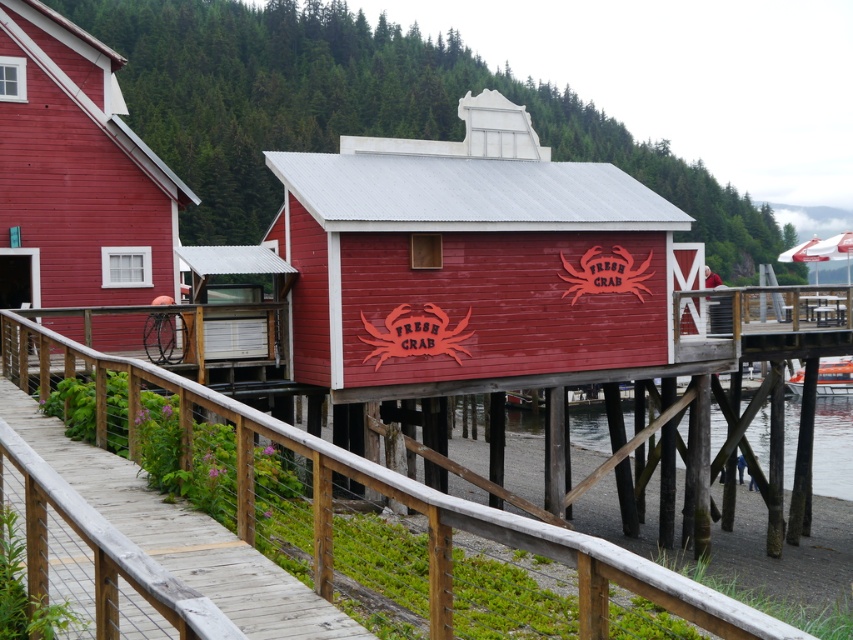
You are standing at the waterfront and see two points marked in the image. The first point is at coordinates point (91, 285) and the second is at point (582, 426). Which point is closer to you?

Point (91, 285) is in front of point (582, 426), so it is closer to you.

You are a photographer planning to capture the waterfront scene. You want to ensure that the matte wood hut at center and the transparent water at lower center are both visible in your shot. Based on their sizes, which object should you position closer to the edge of the frame to avoid overcrowding?

The matte wood hut at center is thinner than transparent water at lower center, so positioning the matte wood hut at center closer to the edge would help avoid overcrowding since it takes up less space in the frame.

You are a tourist standing on the dock and want to visit both the smooth red wood hut at center and the matte wood hut at center. Which one should you visit first if you want to start from the left side of the waterfront?

You should visit the matte wood hut at center first because it is located to the left of the smooth red wood hut at center.